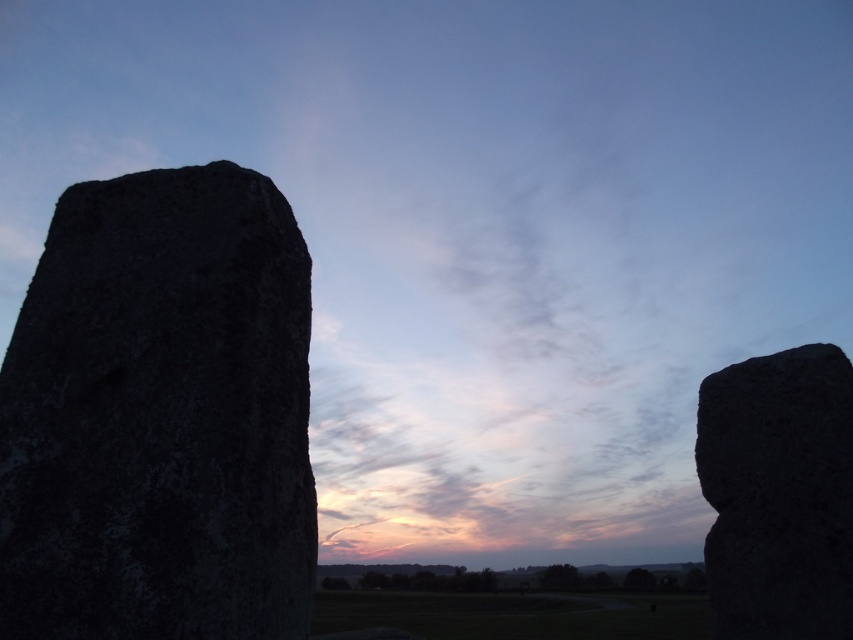
Question: Does granite rock at left have a greater width compared to granite boulder at right?

Choices:
 (A) no
 (B) yes

Answer: (B)

Question: Which of the following is the closest to the observer?

Choices:
 (A) granite rock at left
 (B) granite boulder at right

Answer: (A)

Question: Which of the following is the closest to the observer?

Choices:
 (A) (744, 449)
 (B) (166, 180)

Answer: (B)

Question: Which point appears farthest from the camera in this image?

Choices:
 (A) pyautogui.click(x=241, y=310)
 (B) pyautogui.click(x=782, y=545)

Answer: (B)

Question: Is granite rock at left bigger than granite boulder at right?

Choices:
 (A) yes
 (B) no

Answer: (B)

Question: Can you confirm if granite rock at left is positioned to the left of granite boulder at right?

Choices:
 (A) yes
 (B) no

Answer: (A)